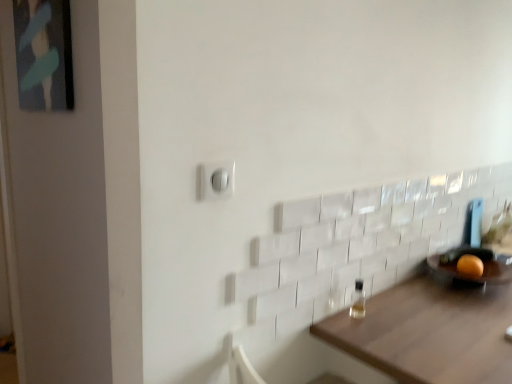
Question: Can you confirm if transparent glass bottle at lower right is shorter than brown wooden table at lower right?

Choices:
 (A) no
 (B) yes

Answer: (B)

Question: Can you confirm if transparent glass bottle at lower right is wider than brown wooden table at lower right?

Choices:
 (A) no
 (B) yes

Answer: (A)

Question: Is transparent glass bottle at lower right facing towards brown wooden table at lower right?

Choices:
 (A) yes
 (B) no

Answer: (B)

Question: From a real-world perspective, is transparent glass bottle at lower right below brown wooden table at lower right?

Choices:
 (A) no
 (B) yes

Answer: (A)

Question: Would you say brown wooden table at lower right is part of transparent glass bottle at lower right's contents?

Choices:
 (A) yes
 (B) no

Answer: (B)

Question: Is orange matte at right inside or outside of white plastic light switch at center?

Choices:
 (A) outside
 (B) inside

Answer: (A)

Question: From the image's perspective, is orange matte at right positioned above or below white plastic light switch at center?

Choices:
 (A) above
 (B) below

Answer: (B)

Question: Is point (460, 269) closer or farther from the camera than point (223, 193)?

Choices:
 (A) farther
 (B) closer

Answer: (A)

Question: In the image, is orange matte at right on the left side or the right side of white plastic light switch at center?

Choices:
 (A) left
 (B) right

Answer: (B)

Question: Considering their positions, is white plastic light switch at center located in front of or behind transparent glass bottle at lower right?

Choices:
 (A) behind
 (B) front

Answer: (B)

Question: Does point (231, 165) appear closer or farther from the camera than point (356, 286)?

Choices:
 (A) farther
 (B) closer

Answer: (B)

Question: Is white plastic light switch at center bigger or smaller than transparent glass bottle at lower right?

Choices:
 (A) big
 (B) small

Answer: (B)

Question: Is white plastic light switch at center taller or shorter than transparent glass bottle at lower right?

Choices:
 (A) short
 (B) tall

Answer: (A)

Question: In terms of height, does matte black picture frame at upper left look taller or shorter compared to brown wooden table at lower right?

Choices:
 (A) short
 (B) tall

Answer: (A)

Question: Relative to brown wooden table at lower right, is matte black picture frame at upper left in front or behind?

Choices:
 (A) behind
 (B) front

Answer: (A)